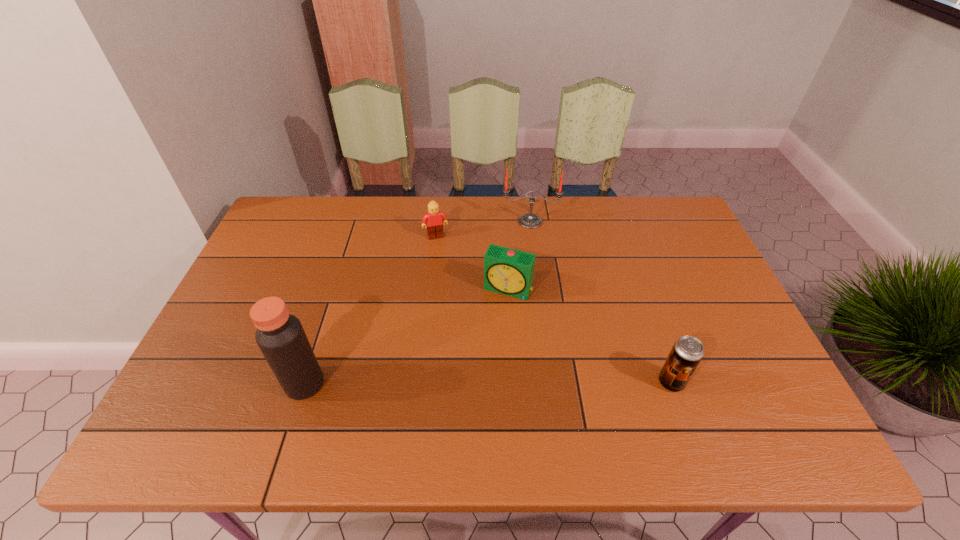
Where is `unoccupied position between the candle and the rightmost object`? unoccupied position between the candle and the rightmost object is located at coordinates (600, 302).

Locate an element on the screen. The height and width of the screenshot is (540, 960). vacant area that lies between the Lego and the tallest object is located at coordinates (371, 310).

Identify the location of free point between the leftmost object and the third farthest object. Image resolution: width=960 pixels, height=540 pixels. (406, 336).

At what (x,y) coordinates should I click in order to perform the action: click on free space between the Lego and the beer can. Please return your answer as a coordinate pair (x, y). Looking at the image, I should click on (553, 309).

Locate an element on the screen. This screenshot has height=540, width=960. free spot between the alarm clock and the beer can is located at coordinates (589, 335).

I want to click on object that can be found as the fourth closest to the rightmost object, so click(x=280, y=336).

Locate an element on the screen. The height and width of the screenshot is (540, 960). object that is the second nearest to the candle is located at coordinates (507, 271).

In order to click on vacant space that satisfies the following two spatial constraints: 1. on the back side of the second farthest object; 2. on the right side of the vinegar in this screenshot , I will do `click(351, 236)`.